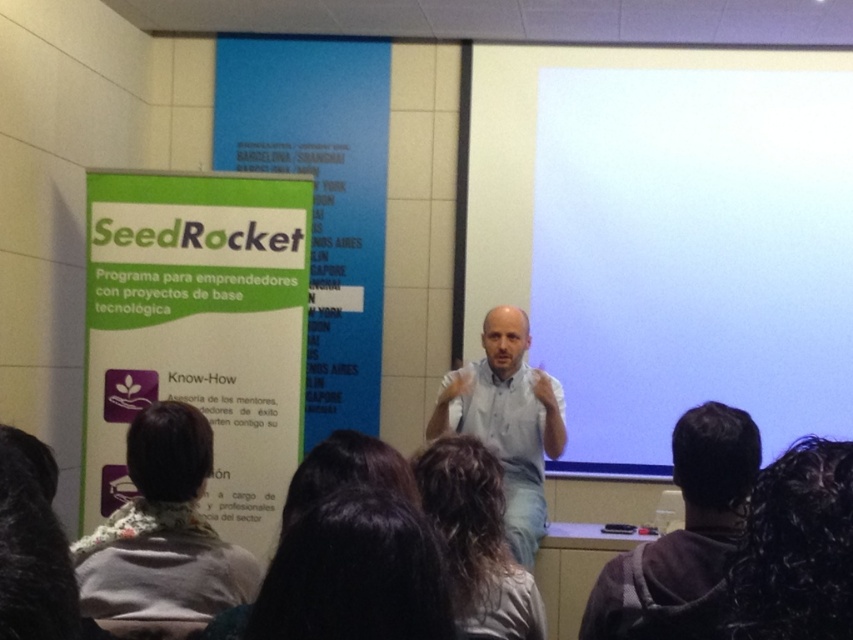
Question: Which object appears closest to the camera in this image?

Choices:
 (A) dark brown hair at lower left
 (B) dark gray hoodie at lower right
 (C) dark brown hair at lower center

Answer: (C)

Question: Among these points, which one is farthest from the camera?

Choices:
 (A) (851, 477)
 (B) (611, 572)
 (C) (343, 570)

Answer: (B)

Question: Is dark gray hoodie at lower right to the right of dark brown hair at lower center from the viewer's perspective?

Choices:
 (A) yes
 (B) no

Answer: (A)

Question: Does white matte projection screen at upper center have a smaller size compared to dark gray hoodie at lower right?

Choices:
 (A) no
 (B) yes

Answer: (A)

Question: Is dark gray hoodie at lower right thinner than light blue shirt at center?

Choices:
 (A) yes
 (B) no

Answer: (A)

Question: Estimate the real-world distances between objects in this image. Which object is closer to the light blue shirt at center?

Choices:
 (A) dark brown hair at lower center
 (B) dark gray hoodie at lower right
 (C) dark curly hair at lower right

Answer: (A)